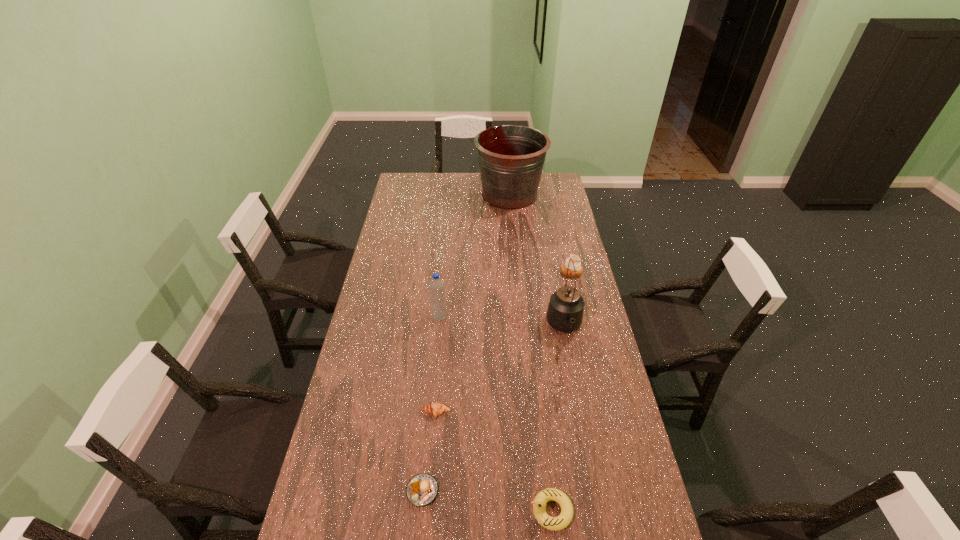
At what (x,y) coordinates should I click in order to perform the action: click on free space located 0.080m on the front of the fifth shortest object. Please return your answer as a coordinate pair (x, y). The image size is (960, 540). Looking at the image, I should click on (438, 338).

Where is `vacant position located 0.400m on the back of the rightmost pastry`? The width and height of the screenshot is (960, 540). vacant position located 0.400m on the back of the rightmost pastry is located at coordinates (558, 214).

Where is `vacant point located on the face of the duckling`? This screenshot has height=540, width=960. vacant point located on the face of the duckling is located at coordinates (386, 511).

This screenshot has width=960, height=540. In order to click on vacant space situated 0.050m on the face of the duckling in this screenshot , I will do `click(511, 511)`.

Identify the location of vacant space situated on the face of the duckling. (503, 511).

Find the location of a particular element. The width and height of the screenshot is (960, 540). vacant position located on the front-facing side of the second farthest pastry is located at coordinates (428, 516).

Identify the location of vacant region located on the left of the nearest pastry. pyautogui.click(x=321, y=491).

The height and width of the screenshot is (540, 960). Identify the location of object situated at the far edge. (511, 157).

You are a GUI agent. You are given a task and a screenshot of the screen. Output one action in this format:
    pyautogui.click(x=<x>, y=<y>)
    Task: Click on the bucket at the right edge
    This screenshot has height=540, width=960.
    Given the screenshot: What is the action you would take?
    pyautogui.click(x=511, y=157)

The width and height of the screenshot is (960, 540). I want to click on kettle that is positioned at the right edge, so click(565, 311).